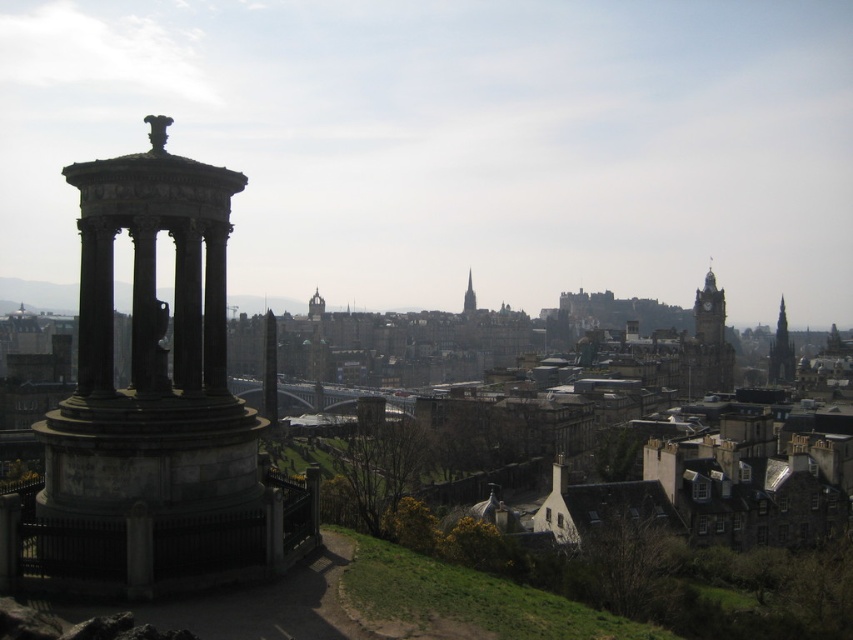
Question: In this image, where is matte stone clock tower at upper right located relative to smooth stone spire at center?

Choices:
 (A) left
 (B) right

Answer: (B)

Question: Can you confirm if gray stone column at left is positioned to the right of smooth stone tower at center?

Choices:
 (A) yes
 (B) no

Answer: (A)

Question: Which point is closer to the camera?

Choices:
 (A) matte stone clock tower at upper right
 (B) gray stone column at left
 (C) smooth stone tower at center

Answer: (B)

Question: Does smooth stone spire at right come in front of smooth stone spire at center?

Choices:
 (A) no
 (B) yes

Answer: (B)

Question: Which point is closer to the camera?

Choices:
 (A) (778, 384)
 (B) (712, 332)
 (C) (310, 307)

Answer: (A)

Question: Estimate the real-world distances between objects in this image. Which object is farther from the smooth stone spire at right?

Choices:
 (A) matte stone clock tower at upper right
 (B) smooth stone spire at center
 (C) gray stone column at left
 (D) smooth stone tower at center

Answer: (C)